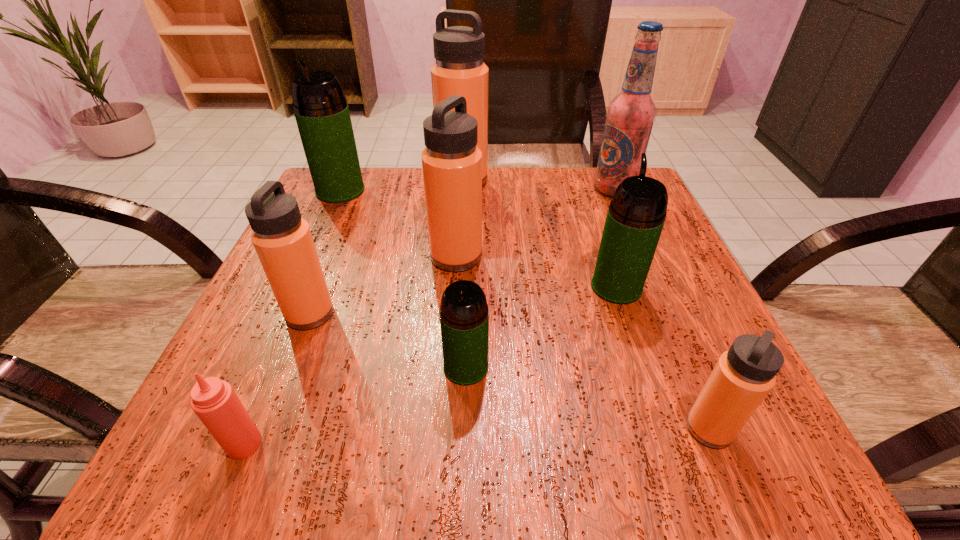
The image size is (960, 540). Identify the location of alcohol positioned at the right edge. (630, 115).

I want to click on object that is at the far left corner, so click(x=321, y=111).

Where is `object that is at the near left corner`? This screenshot has height=540, width=960. object that is at the near left corner is located at coordinates (214, 401).

Find the location of `object that is at the far right corner`. object that is at the far right corner is located at coordinates (630, 115).

The width and height of the screenshot is (960, 540). Find the location of `object positioned at the near right corner`. object positioned at the near right corner is located at coordinates (743, 376).

Locate an element on the screen. This screenshot has height=540, width=960. free region at the far edge is located at coordinates (394, 194).

Where is `vacant space at the near edge of the desktop`? Image resolution: width=960 pixels, height=540 pixels. vacant space at the near edge of the desktop is located at coordinates (638, 411).

Where is `vacant point at the left edge`? This screenshot has width=960, height=540. vacant point at the left edge is located at coordinates (253, 310).

The height and width of the screenshot is (540, 960). In the image, there is a desktop. What are the coordinates of `free space at the right edge` in the screenshot? It's located at (686, 286).

In the image, there is a desktop. At what (x,y) coordinates should I click in order to perform the action: click on vacant space at the far left corner. Please return your answer as a coordinate pair (x, y). Looking at the image, I should click on (351, 220).